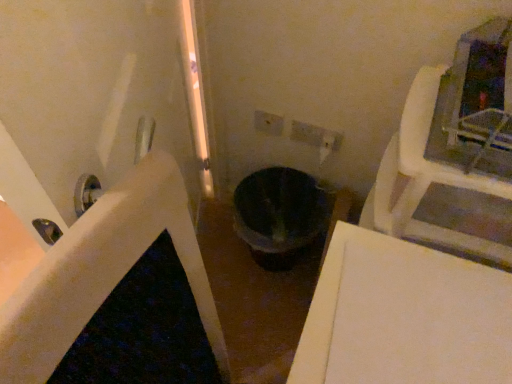
Image resolution: width=512 pixels, height=384 pixels. What are the coordinates of `white plastic electric outlet at center` in the screenshot? It's located at (268, 123).

The height and width of the screenshot is (384, 512). What do you see at coordinates (279, 215) in the screenshot?
I see `black matte toilet bowl at center` at bounding box center [279, 215].

The height and width of the screenshot is (384, 512). In order to click on black glossy bath at center in this screenshot , I will do `click(181, 227)`.

Where is `white plastic electric outlet at center`? Image resolution: width=512 pixels, height=384 pixels. white plastic electric outlet at center is located at coordinates (268, 123).

Relative to black matte toilet bowl at center, is white plastic electric outlet at center in front or behind?

white plastic electric outlet at center is in front of black matte toilet bowl at center.

Which of these two, white plastic electric outlet at center or black matte toilet bowl at center, is smaller?

white plastic electric outlet at center.

Is there a large distance between white plastic electric outlet at center and black matte toilet bowl at center?

white plastic electric outlet at center is actually quite close to black matte toilet bowl at center.

In the scene shown: Which point is more distant from viewer, (x=148, y=181) or (x=261, y=213)?

The point (x=261, y=213) is farther.

From a real-world perspective, who is located higher, black glossy bath at center or black matte toilet bowl at center?

From a 3D spatial view, black matte toilet bowl at center is above.

Which is more to the right, black glossy bath at center or black matte toilet bowl at center?

→ From the viewer's perspective, black matte toilet bowl at center appears more on the right side.

In the scene shown: Can you confirm if black glossy bath at center is wider than black matte toilet bowl at center?

Correct, the width of black glossy bath at center exceeds that of black matte toilet bowl at center.

Would you say white plastic electric outlet at center contains black glossy bath at center?

No, black glossy bath at center is not surrounded by white plastic electric outlet at center.

Considering the relative positions of white plastic electric outlet at center and black glossy bath at center in the image provided, is white plastic electric outlet at center to the right of black glossy bath at center from the viewer's perspective?

Yes.

Which of these two, white plastic electric outlet at center or black glossy bath at center, stands shorter?

black glossy bath at center is shorter.

From the picture: From the image's perspective, relative to black glossy bath at center, is white plastic electric outlet at center above or below?

white plastic electric outlet at center is situated higher than black glossy bath at center in the image.

Is the depth of black glossy bath at center less than that of white plastic electric outlet at center?

No, black glossy bath at center is behind white plastic electric outlet at center.

Does black glossy bath at center have a lesser width compared to white plastic electric outlet at center?

No.

Would you say black glossy bath at center is outside white plastic electric outlet at center?

Yes, black glossy bath at center is not within white plastic electric outlet at center.

Considering the sizes of objects black glossy bath at center and white plastic electric outlet at center in the image provided, who is taller, black glossy bath at center or white plastic electric outlet at center?

With more height is white plastic electric outlet at center.

Is black matte toilet bowl at center oriented away from black glossy bath at center?

No, black matte toilet bowl at center's orientation is not away from black glossy bath at center.

Measure the distance between black matte toilet bowl at center and black glossy bath at center.

28.58 inches.

Can you tell me how much black matte toilet bowl at center and black glossy bath at center differ in facing direction?

The angular difference between black matte toilet bowl at center and black glossy bath at center is 85.2 degrees.

Is black matte toilet bowl at center wider than black glossy bath at center?

No, black matte toilet bowl at center is not wider than black glossy bath at center.

How different are the orientations of black matte toilet bowl at center and white plastic electric outlet at center in degrees?

89.5 degrees.

Is white plastic electric outlet at center completely or partially inside black matte toilet bowl at center?

Definitely not — white plastic electric outlet at center is not inside black matte toilet bowl at center.

From the image's perspective, relative to white plastic electric outlet at center, is black matte toilet bowl at center above or below?

Clearly, from the image's perspective, black matte toilet bowl at center is below white plastic electric outlet at center.

Locate an element on the screen. This screenshot has height=384, width=512. toilet bowl that is behind the white plastic electric outlet at center is located at coordinates (279, 215).

I want to click on toilet bowl below the white plastic electric outlet at center (from a real-world perspective), so click(x=279, y=215).

Identify the location of toilet bowl above the black glossy bath at center (from a real-world perspective). The height and width of the screenshot is (384, 512). (279, 215).

Which object lies nearer to the anchor point white plastic electric outlet at center, black glossy bath at center or black matte toilet bowl at center?

black matte toilet bowl at center is positioned closer to the anchor white plastic electric outlet at center.

Which object lies further to the anchor point black matte toilet bowl at center, black glossy bath at center or white plastic electric outlet at center?

black glossy bath at center lies further to black matte toilet bowl at center than the other object.

Based on their spatial positions, is black matte toilet bowl at center or white plastic electric outlet at center closer to black glossy bath at center?

black matte toilet bowl at center is positioned closer to the anchor black glossy bath at center.

Looking at the image, which one is located further to white plastic electric outlet at center, black matte toilet bowl at center or black glossy bath at center?

Based on the image, black glossy bath at center appears to be further to white plastic electric outlet at center.

Based on their spatial positions, is white plastic electric outlet at center or black glossy bath at center closer to black matte toilet bowl at center?

Among the two, white plastic electric outlet at center is located nearer to black matte toilet bowl at center.

Based on their spatial positions, is white plastic electric outlet at center or black matte toilet bowl at center further from black glossy bath at center?

Among the two, white plastic electric outlet at center is located further to black glossy bath at center.

Where is `electric outlet located between black glossy bath at center and black matte toilet bowl at center in the left-right direction`? electric outlet located between black glossy bath at center and black matte toilet bowl at center in the left-right direction is located at coordinates (268, 123).